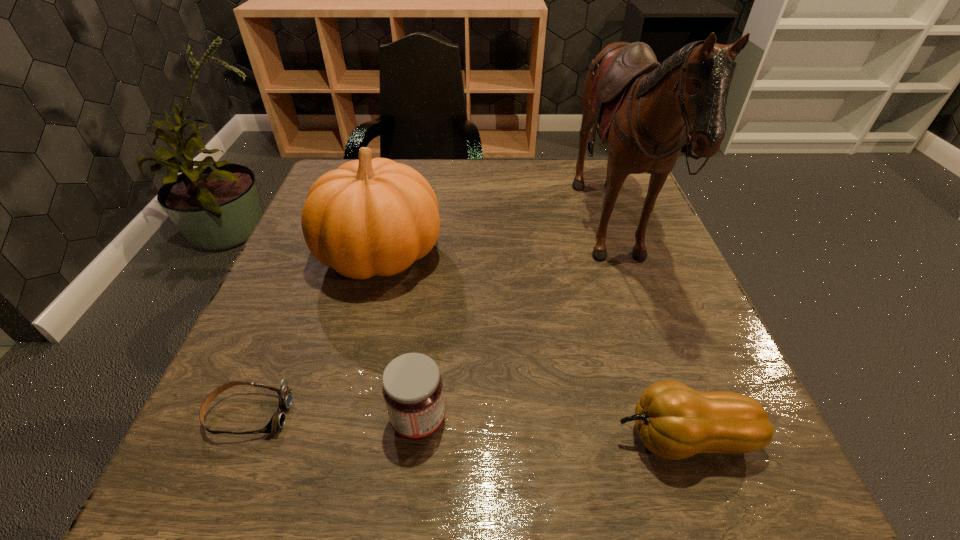
The width and height of the screenshot is (960, 540). Identify the location of the second closest object to the gourd. (412, 387).

Identify which object is the closest to the jam. Please provide its 2D coordinates. Your answer should be formatted as a tuple, i.e. [(x, y)], where the tuple contains the x and y coordinates of a point satisfying the conditions above.

[(277, 421)]

The height and width of the screenshot is (540, 960). In order to click on vacant space that satisfies the following two spatial constraints: 1. on the front-facing side of the goggles; 2. on the right side of the jam in this screenshot , I will do `click(247, 420)`.

Find the location of a particular element. This screenshot has width=960, height=540. free space in the image that satisfies the following two spatial constraints: 1. on the back side of the jam; 2. on the front-facing side of the goggles is located at coordinates (420, 414).

Where is `free space in the image that satisfies the following two spatial constraints: 1. on the front-facing side of the jam; 2. on the left side of the shortest object`? This screenshot has height=540, width=960. free space in the image that satisfies the following two spatial constraints: 1. on the front-facing side of the jam; 2. on the left side of the shortest object is located at coordinates (247, 420).

The width and height of the screenshot is (960, 540). Find the location of `vacant space that satisfies the following two spatial constraints: 1. on the front-facing side of the jam; 2. on the right side of the shortest object`. vacant space that satisfies the following two spatial constraints: 1. on the front-facing side of the jam; 2. on the right side of the shortest object is located at coordinates (247, 420).

Where is `free point that satisfies the following two spatial constraints: 1. on the front-facing side of the shortest object; 2. on the left side of the jam`? The width and height of the screenshot is (960, 540). free point that satisfies the following two spatial constraints: 1. on the front-facing side of the shortest object; 2. on the left side of the jam is located at coordinates (247, 420).